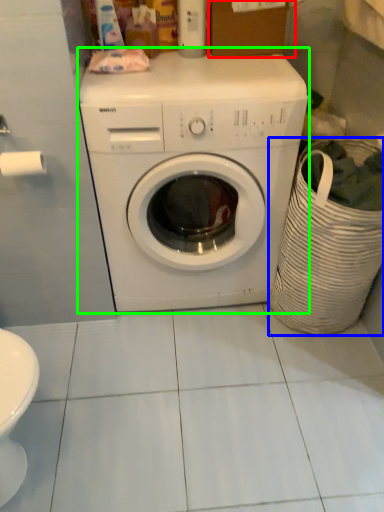
Question: Which object is positioned closest to cardboard box (highlighted by a red box)? Select from laundry basket (highlighted by a blue box) and washing machine (highlighted by a green box).

Choices:
 (A) laundry basket
 (B) washing machine

Answer: (B)